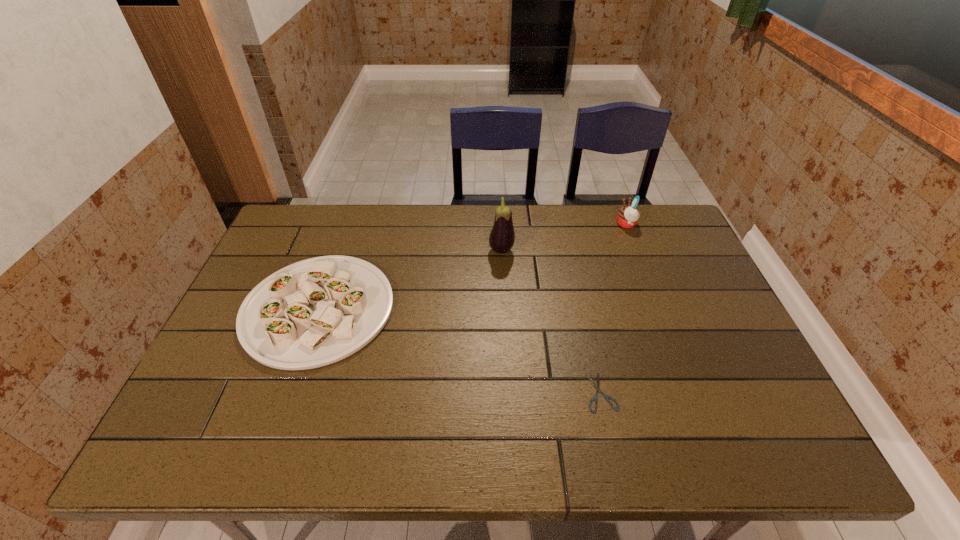
Where is `blank area at the near edge`? Image resolution: width=960 pixels, height=540 pixels. blank area at the near edge is located at coordinates (344, 447).

This screenshot has height=540, width=960. In order to click on free space at the left edge in this screenshot , I will do `click(194, 395)`.

In the image, there is a desktop. Identify the location of vacant space at the right edge. Image resolution: width=960 pixels, height=540 pixels. (731, 368).

Identify the location of free space at the near right corner. This screenshot has height=540, width=960. (786, 451).

Find the location of a particular element. The image size is (960, 540). free point between the eggplant and the second shortest object is located at coordinates (410, 280).

The width and height of the screenshot is (960, 540). Identify the location of vacant region between the second object from right to left and the muffin. (613, 308).

What are the coordinates of `vacant space in between the nearest object and the rightmost object` in the screenshot? It's located at (613, 308).

I want to click on vacant space that is in between the eggplant and the third tallest object, so click(x=410, y=280).

Identify the location of empty space that is in between the eggplant and the leftmost object. (410, 280).

Locate an element on the screen. The height and width of the screenshot is (540, 960). free space between the muffin and the shortest object is located at coordinates (613, 308).